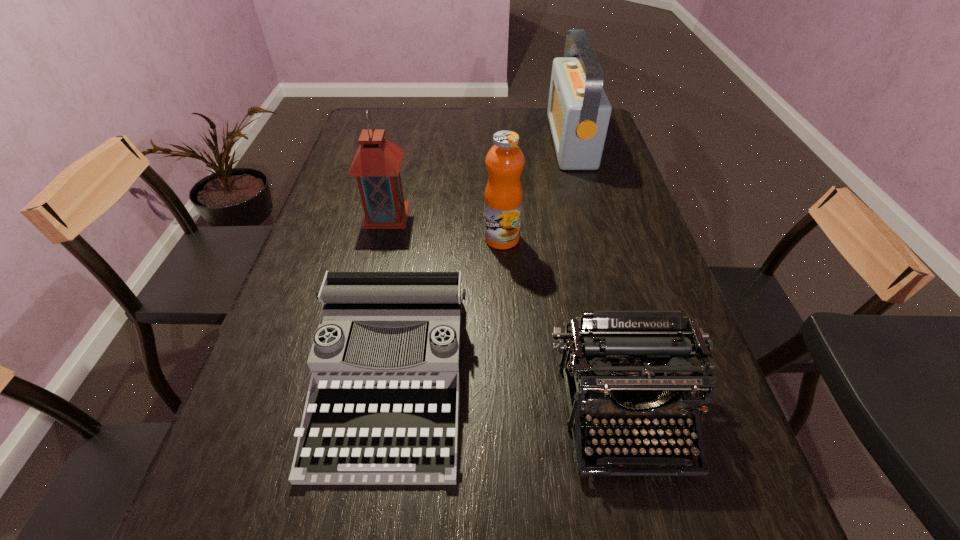
Find the location of `radio receiver`. radio receiver is located at coordinates (579, 111).

Where is `lantern`? This screenshot has width=960, height=540. lantern is located at coordinates (376, 164).

This screenshot has height=540, width=960. I want to click on the third object from right to left, so click(503, 196).

At what (x,y) coordinates should I click in order to perform the action: click on the taller typewriter. Please return your answer as a coordinate pair (x, y). Image resolution: width=960 pixels, height=540 pixels. Looking at the image, I should click on tap(618, 358).

I want to click on the right typewriter, so click(x=618, y=358).

Find the location of a particular element. The image size is (960, 540). the shorter typewriter is located at coordinates (382, 408).

This screenshot has height=540, width=960. I want to click on the shortest object, so click(x=382, y=408).

The image size is (960, 540). I want to click on vacant area situated on the front-facing side of the radio receiver, so click(x=448, y=141).

The height and width of the screenshot is (540, 960). I want to click on vacant space located 0.330m on the front-facing side of the radio receiver, so click(457, 141).

You are a GUI agent. You are given a task and a screenshot of the screen. Output one action in this format:
    pyautogui.click(x=<x>, y=<y>)
    Task: Click on the free space located on the front-facing side of the radio receiver
    This screenshot has width=960, height=540.
    Given the screenshot: What is the action you would take?
    pyautogui.click(x=480, y=141)